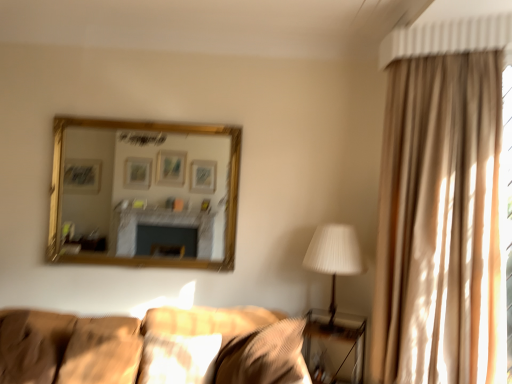
Locate an element on the screen. matte beige pillow at center, which is counted as the third pillow, starting from the left is located at coordinates (178, 358).

This screenshot has height=384, width=512. Describe the element at coordinates (178, 358) in the screenshot. I see `matte beige pillow at center, which is counted as the third pillow, starting from the left` at that location.

Describe the element at coordinates (441, 224) in the screenshot. I see `beige fabric curtain at right` at that location.

Identify the location of matte beige pillow at center, placed as the second pillow when sorted from right to left. Image resolution: width=512 pixels, height=384 pixels. (178, 358).

What's the angular difference between suede-like brown pillow at lower left, which is the 1th pillow from left to right, and matte beige pillow at center, placed as the second pillow when sorted from right to left,'s facing directions?

The angular difference between suede-like brown pillow at lower left, which is the 1th pillow from left to right, and matte beige pillow at center, placed as the second pillow when sorted from right to left, is 91.2 degrees.

Based on the photo, does suede-like brown pillow at lower left, arranged as the fourth pillow when viewed from the right, have a larger size compared to matte beige pillow at center, placed as the second pillow when sorted from right to left?

Yes, suede-like brown pillow at lower left, arranged as the fourth pillow when viewed from the right, is bigger than matte beige pillow at center, placed as the second pillow when sorted from right to left.

Which pillow is the 2nd one when counting from the back of the suede-like brown pillow at lower left, which is the 1th pillow from left to right? Please provide its 2D coordinates.

[(178, 358)]

Considering the positions of point (0, 383) and point (156, 379), is point (0, 383) closer or farther from the camera than point (156, 379)?

Point (0, 383).

The height and width of the screenshot is (384, 512). In order to click on the 2nd pillow below the textured beige pillow at lower center, acting as the fourth pillow starting from the left (from a real-world perspective) in this screenshot , I will do `click(33, 345)`.

Considering the sizes of objects suede-like brown pillow at lower left, arranged as the fourth pillow when viewed from the right, and textured beige pillow at lower center, the first pillow in the right-to-left sequence, in the image provided, who is shorter, suede-like brown pillow at lower left, arranged as the fourth pillow when viewed from the right, or textured beige pillow at lower center, the first pillow in the right-to-left sequence,?

Standing shorter between the two is textured beige pillow at lower center, the first pillow in the right-to-left sequence.

From the image's perspective, which object appears higher, suede-like brown pillow at lower left, arranged as the fourth pillow when viewed from the right, or textured beige pillow at lower center, the first pillow in the right-to-left sequence?

From the image's view, textured beige pillow at lower center, the first pillow in the right-to-left sequence, is above.

From a real-world perspective, is suede-like brown pillow at lower left, which is the 1th pillow from left to right, positioned under textured beige pillow at lower center, acting as the fourth pillow starting from the left, based on gravity?

Yes, from a real-world perspective, suede-like brown pillow at lower left, which is the 1th pillow from left to right, is below textured beige pillow at lower center, acting as the fourth pillow starting from the left.

From a real-world perspective, which is physically below, matte beige pillow at center, placed as the second pillow when sorted from right to left, or textured beige pillow at lower center, acting as the fourth pillow starting from the left?

In real-world perspective, matte beige pillow at center, placed as the second pillow when sorted from right to left, is lower.

Measure the distance from matte beige pillow at center, placed as the second pillow when sorted from right to left, to textured beige pillow at lower center, acting as the fourth pillow starting from the left.

matte beige pillow at center, placed as the second pillow when sorted from right to left, and textured beige pillow at lower center, acting as the fourth pillow starting from the left, are 9.78 inches apart.

Can you confirm if matte beige pillow at center, which is counted as the third pillow, starting from the left, is bigger than textured beige pillow at lower center, acting as the fourth pillow starting from the left?

No, matte beige pillow at center, which is counted as the third pillow, starting from the left, is not bigger than textured beige pillow at lower center, acting as the fourth pillow starting from the left.

Between matte beige pillow at center, placed as the second pillow when sorted from right to left, and textured beige pillow at lower center, the first pillow in the right-to-left sequence, which one is positioned behind?

matte beige pillow at center, placed as the second pillow when sorted from right to left, is more distant.

From the image's perspective, does gold-framed mirror at upper center appear lower than white pleated fabric at right?

No, from the image's perspective, gold-framed mirror at upper center is not below white pleated fabric at right.

Is point (124, 192) farther from viewer compared to point (334, 236)?

That is True.

Does gold-framed mirror at upper center appear on the right side of white pleated fabric at right?

No, gold-framed mirror at upper center is not to the right of white pleated fabric at right.

Is gold-framed mirror at upper center aimed at white pleated fabric at right?

No.

From the picture: From a real-world perspective, is metallic silver table at lower right under soft beige pillow at lower left, which ranks as the 3th pillow in right-to-left order?

Indeed, from a real-world perspective, metallic silver table at lower right is positioned beneath soft beige pillow at lower left, which ranks as the 3th pillow in right-to-left order.

Is metallic silver table at lower right beside soft beige pillow at lower left, which ranks as the second pillow in left-to-right order?

No, metallic silver table at lower right is not with soft beige pillow at lower left, which ranks as the second pillow in left-to-right order.

Considering the sizes of objects metallic silver table at lower right and soft beige pillow at lower left, which ranks as the 3th pillow in right-to-left order, in the image provided, who is thinner, metallic silver table at lower right or soft beige pillow at lower left, which ranks as the 3th pillow in right-to-left order,?

With smaller width is soft beige pillow at lower left, which ranks as the 3th pillow in right-to-left order.

Who is shorter, beige fabric curtain at right or metallic silver table at lower right?

With less height is metallic silver table at lower right.

Which object is wider, beige fabric curtain at right or metallic silver table at lower right?

Wider between the two is metallic silver table at lower right.

Considering the positions of objects beige fabric curtain at right and metallic silver table at lower right in the image provided, who is more to the right, beige fabric curtain at right or metallic silver table at lower right?

beige fabric curtain at right.

Between point (503, 363) and point (335, 340), which one is positioned in front?

The point (503, 363) is closer to the camera.

Is matte beige pillow at center, placed as the second pillow when sorted from right to left, oriented towards metallic silver table at lower right?

No, matte beige pillow at center, placed as the second pillow when sorted from right to left, is not aimed at metallic silver table at lower right.

Which object is further away from the camera taking this photo, matte beige pillow at center, which is counted as the third pillow, starting from the left, or metallic silver table at lower right?

metallic silver table at lower right is more distant.

Based on the photo, from the image's perspective, is matte beige pillow at center, placed as the second pillow when sorted from right to left, over metallic silver table at lower right?

Correct, matte beige pillow at center, placed as the second pillow when sorted from right to left, appears higher than metallic silver table at lower right in the image.

At what (x,y) coordinates should I click in order to perform the action: click on the 1st pillow positioned above the matte beige pillow at center, which is counted as the third pillow, starting from the left (from the image's perspective). Please return your answer as a coordinate pair (x, y). Looking at the image, I should click on (33, 345).

I want to click on the 3rd pillow to the left of the textured beige pillow at lower center, acting as the fourth pillow starting from the left, starting your count from the anchor, so click(x=33, y=345).

From the image, which object appears to be farther from metallic silver table at lower right, soft beige pillow at lower left, which ranks as the 3th pillow in right-to-left order, or white pleated fabric at right?

Among the two, soft beige pillow at lower left, which ranks as the 3th pillow in right-to-left order, is located further to metallic silver table at lower right.

Looking at the image, which one is located closer to matte beige pillow at center, which is counted as the third pillow, starting from the left, suede-like brown pillow at lower left, which is the 1th pillow from left to right, or white pleated fabric at right?

The object closer to matte beige pillow at center, which is counted as the third pillow, starting from the left, is suede-like brown pillow at lower left, which is the 1th pillow from left to right.

Based on their spatial positions, is soft beige pillow at lower left, which ranks as the second pillow in left-to-right order, or matte beige pillow at center, which is counted as the third pillow, starting from the left, closer to suede-like brown pillow at lower left, arranged as the fourth pillow when viewed from the right?

soft beige pillow at lower left, which ranks as the second pillow in left-to-right order, is positioned closer to the anchor suede-like brown pillow at lower left, arranged as the fourth pillow when viewed from the right.

Based on their spatial positions, is white pleated fabric at right or matte beige pillow at center, placed as the second pillow when sorted from right to left, closer to gold-framed mirror at upper center?

white pleated fabric at right.

Considering their positions, is white pleated fabric at right positioned further to textured beige pillow at lower center, acting as the fourth pillow starting from the left, than suede-like brown pillow at lower left, arranged as the fourth pillow when viewed from the right?

suede-like brown pillow at lower left, arranged as the fourth pillow when viewed from the right, lies further to textured beige pillow at lower center, acting as the fourth pillow starting from the left, than the other object.

Estimate the real-world distances between objects in this image. Which object is closer to white pleated fabric at right, soft beige pillow at lower left, which ranks as the second pillow in left-to-right order, or suede-like brown pillow at lower left, which is the 1th pillow from left to right?

soft beige pillow at lower left, which ranks as the second pillow in left-to-right order, lies closer to white pleated fabric at right than the other object.

Based on their spatial positions, is white pleated fabric at right or metallic silver table at lower right further from suede-like brown pillow at lower left, arranged as the fourth pillow when viewed from the right?

white pleated fabric at right is positioned further to the anchor suede-like brown pillow at lower left, arranged as the fourth pillow when viewed from the right.

Estimate the real-world distances between objects in this image. Which object is further from metallic silver table at lower right, gold-framed mirror at upper center or textured beige pillow at lower center, acting as the fourth pillow starting from the left?

Among the two, gold-framed mirror at upper center is located further to metallic silver table at lower right.

Image resolution: width=512 pixels, height=384 pixels. I want to click on table between suede-like brown pillow at lower left, which is the 1th pillow from left to right, and beige fabric curtain at right, in the horizontal direction, so click(x=335, y=347).

Where is `pillow between matte beige pillow at center, which is counted as the third pillow, starting from the left, and white pleated fabric at right from left to right`? pillow between matte beige pillow at center, which is counted as the third pillow, starting from the left, and white pleated fabric at right from left to right is located at coordinates (264, 356).

You are a GUI agent. You are given a task and a screenshot of the screen. Output one action in this format:
    pyautogui.click(x=<x>, y=<y>)
    Task: Click on the pillow situated between suede-like brown pillow at lower left, which is the 1th pillow from left to right, and matte beige pillow at center, placed as the second pillow when sorted from right to left, from left to right
    This screenshot has width=512, height=384.
    Given the screenshot: What is the action you would take?
    pyautogui.click(x=102, y=352)

Locate an element on the screen. This screenshot has width=512, height=384. mirror between suede-like brown pillow at lower left, arranged as the fourth pillow when viewed from the right, and textured beige pillow at lower center, the first pillow in the right-to-left sequence, in the horizontal direction is located at coordinates (147, 190).